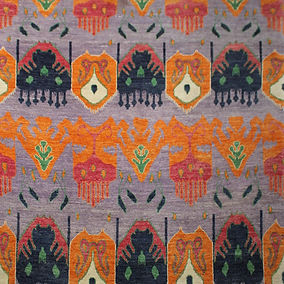
This screenshot has height=284, width=284. I want to click on partial green plant-like objects, so click(x=44, y=2), click(x=139, y=3), click(x=233, y=7).